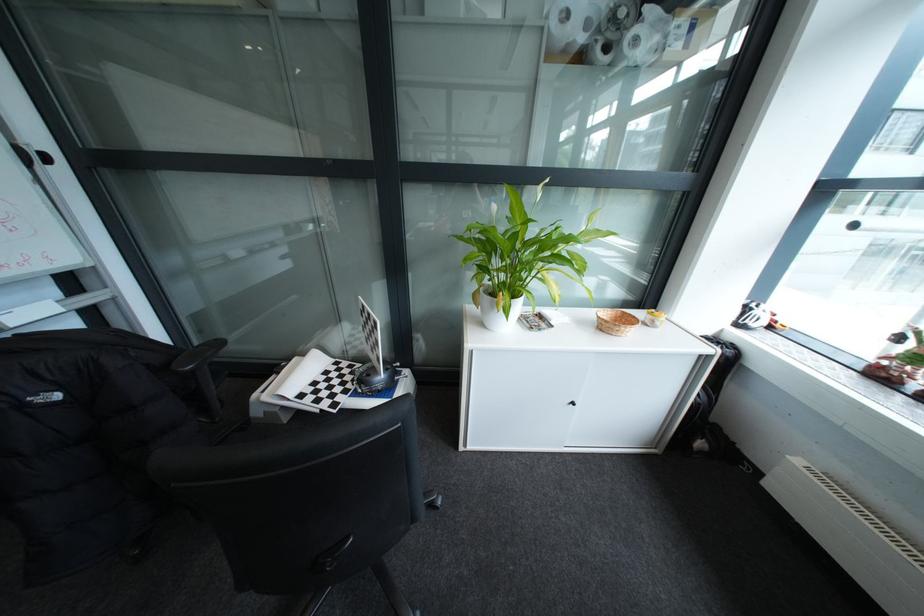
Where would you lift the checkerboard calibration target? Please return your answer as a coordinate pair (x, y).

(330, 386)